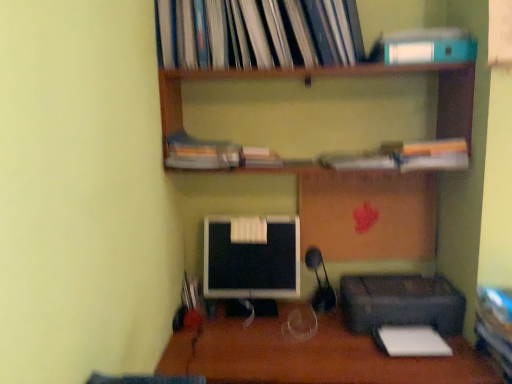
Locate an element on the screen. This screenshot has height=384, width=512. vacant space in black glossy monitor at center (from a real-world perspective) is located at coordinates (252, 308).